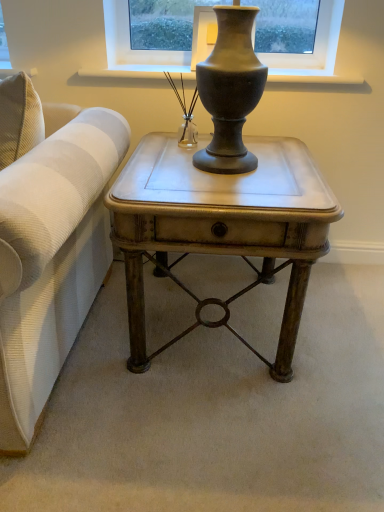
Question: Are matte metallic side table at center and matte gray vase at upper center located far from each other?

Choices:
 (A) no
 (B) yes

Answer: (A)

Question: Considering the relative sizes of matte metallic side table at center and matte gray vase at upper center in the image provided, is matte metallic side table at center bigger than matte gray vase at upper center?

Choices:
 (A) yes
 (B) no

Answer: (A)

Question: Is matte metallic side table at center facing towards matte gray vase at upper center?

Choices:
 (A) no
 (B) yes

Answer: (A)

Question: Is matte metallic side table at center positioned before matte gray vase at upper center?

Choices:
 (A) yes
 (B) no

Answer: (A)

Question: Does matte metallic side table at center have a smaller size compared to matte gray vase at upper center?

Choices:
 (A) no
 (B) yes

Answer: (A)

Question: From the image's perspective, is matte gray vase at upper center located above or below matte metallic side table at center?

Choices:
 (A) below
 (B) above

Answer: (B)

Question: From a real-world perspective, is matte gray vase at upper center positioned above or below matte metallic side table at center?

Choices:
 (A) below
 (B) above

Answer: (B)

Question: Visually, is matte gray vase at upper center positioned to the left or to the right of matte metallic side table at center?

Choices:
 (A) right
 (B) left

Answer: (A)

Question: Does point (357, 76) appear closer or farther from the camera than point (127, 367)?

Choices:
 (A) farther
 (B) closer

Answer: (A)

Question: From a real-world perspective, is clear glass vase at center above or below matte metallic side table at center?

Choices:
 (A) above
 (B) below

Answer: (A)

Question: Is point (183, 94) positioned closer to the camera than point (187, 181)?

Choices:
 (A) closer
 (B) farther

Answer: (B)

Question: In terms of height, does clear glass vase at center look taller or shorter compared to matte metallic side table at center?

Choices:
 (A) short
 (B) tall

Answer: (A)

Question: From the image's perspective, is clear glass vase at center positioned above or below matte metallic side table at center?

Choices:
 (A) below
 (B) above

Answer: (B)

Question: Is point (299, 223) closer or farther from the camera than point (173, 87)?

Choices:
 (A) farther
 (B) closer

Answer: (B)

Question: Is matte metallic side table at center wider or thinner than clear glass vase at center?

Choices:
 (A) thin
 (B) wide

Answer: (B)